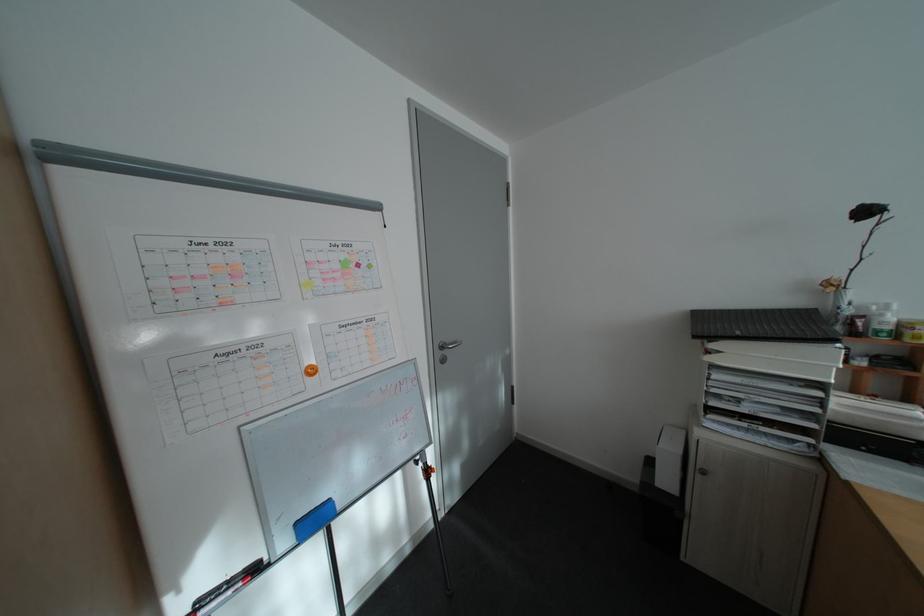
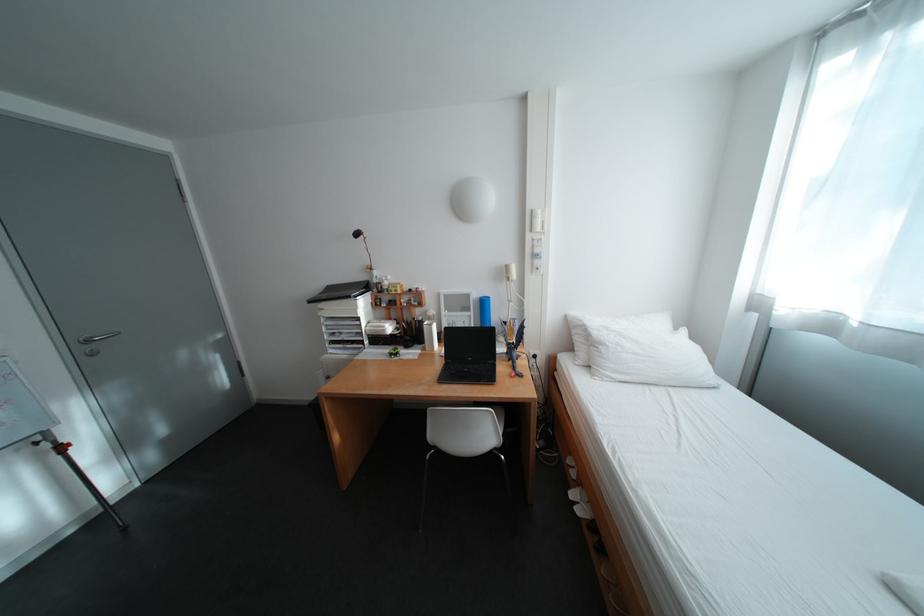
Locate, in the second image, the point that corresponds to point 432,463 in the first image.

(55, 444)